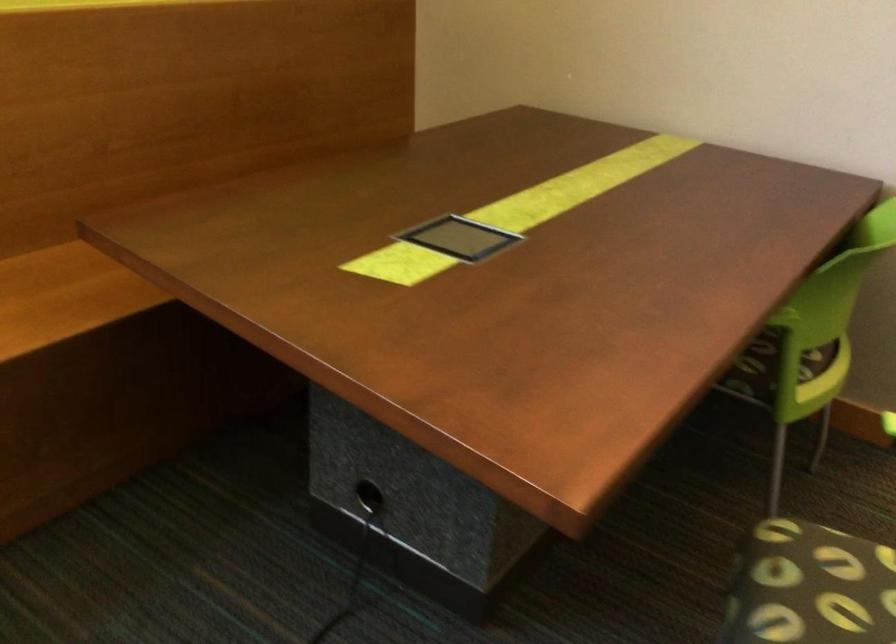
Locate an element on the screen. Image resolution: width=896 pixels, height=644 pixels. green chair seat is located at coordinates click(815, 587).